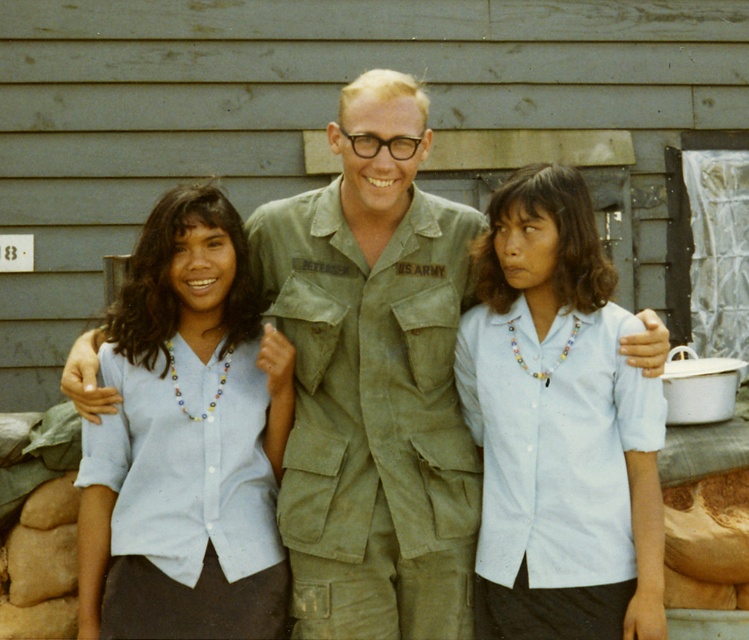
You are a photographer trying to capture a group photo of the green matte uniform at center and the light blue cotton shirt at left. Since you want to ensure both subjects are centered in the frame, which direction should you move the camera to align them properly?

The green matte uniform at center is currently to the right of the light blue cotton shirt at left. To center both subjects in the frame, you should move the camera slightly to the right so that the green matte uniform at center shifts leftward and the light blue cotton shirt at left moves rightward in the frame.

You are a photographer trying to decide which shirt to focus on for a closeup. Since the white matte shirt at center is thinner than the light blue cotton shirt at left, which one would you choose if you want to highlight the texture of the fabric?

The light blue cotton shirt at left has a thicker fabric, so it would be better to focus on the light blue cotton shirt at left to highlight the texture of the fabric.